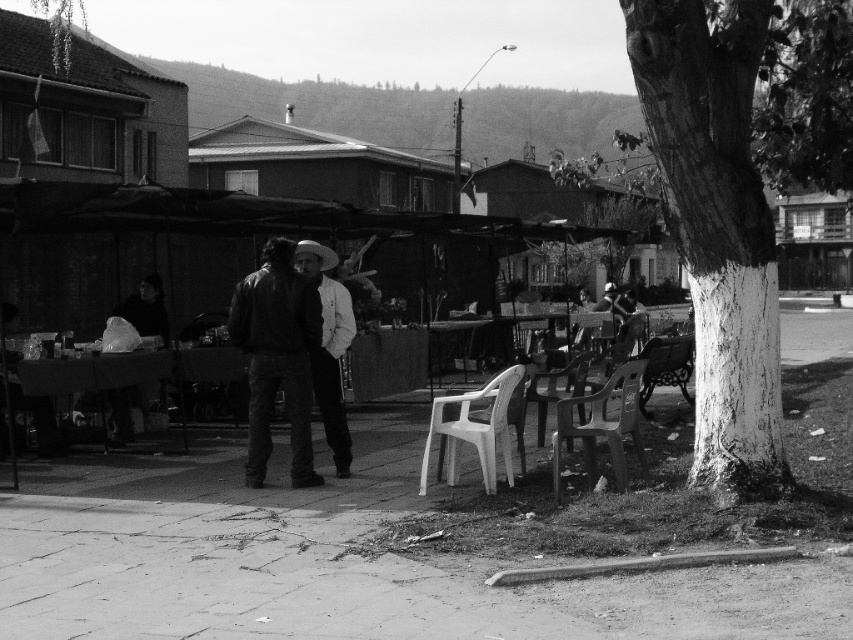
Question: Which point appears farthest from the camera in this image?

Choices:
 (A) (334, 380)
 (B) (590, 403)
 (C) (456, 460)
 (D) (238, 314)

Answer: (B)

Question: Which of these objects is positioned farthest from the plastic chair at lower center?

Choices:
 (A) metallic polished bench at lower right
 (B) white plastic chair at lower center

Answer: (A)

Question: Is plastic chair at lower right further to camera compared to plastic chair at lower center?

Choices:
 (A) no
 (B) yes

Answer: (A)

Question: Among these objects, which one is farthest from the camera?

Choices:
 (A) plastic chair at lower center
 (B) white plastic chair at lower center

Answer: (A)

Question: Does smooth concrete pavement at center appear on the left side of white plastic chair at lower center?

Choices:
 (A) yes
 (B) no

Answer: (A)

Question: Can you confirm if white plastic chair at lower center is wider than metallic polished bench at lower right?

Choices:
 (A) no
 (B) yes

Answer: (A)